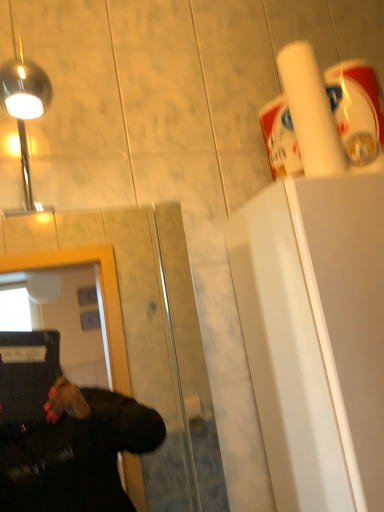
Question: Would you say transparent glass door at center is a long distance from white matte paper towel at upper right?

Choices:
 (A) no
 (B) yes

Answer: (A)

Question: Can you confirm if transparent glass door at center is wider than white matte paper towel at upper right?

Choices:
 (A) yes
 (B) no

Answer: (A)

Question: Is transparent glass door at center positioned in front of white matte paper towel at upper right?

Choices:
 (A) yes
 (B) no

Answer: (A)

Question: Is white matte paper towel at upper right a part of transparent glass door at center?

Choices:
 (A) no
 (B) yes

Answer: (A)

Question: From the image's perspective, does transparent glass door at center appear lower than white matte paper towel at upper right?

Choices:
 (A) no
 (B) yes

Answer: (B)

Question: Is transparent glass door at center oriented towards white matte paper towel at upper right?

Choices:
 (A) yes
 (B) no

Answer: (B)

Question: Considering the relative sizes of polished chrome light at upper left and transparent glass door at center in the image provided, is polished chrome light at upper left taller than transparent glass door at center?

Choices:
 (A) yes
 (B) no

Answer: (B)

Question: Does polished chrome light at upper left lie in front of transparent glass door at center?

Choices:
 (A) no
 (B) yes

Answer: (A)

Question: Is polished chrome light at upper left completely or partially outside of transparent glass door at center?

Choices:
 (A) yes
 (B) no

Answer: (A)

Question: Is polished chrome light at upper left aimed at transparent glass door at center?

Choices:
 (A) no
 (B) yes

Answer: (A)

Question: Would you say polished chrome light at upper left contains transparent glass door at center?

Choices:
 (A) no
 (B) yes

Answer: (A)

Question: Considering the relative positions of polished chrome light at upper left and transparent glass door at center in the image provided, is polished chrome light at upper left to the right of transparent glass door at center from the viewer's perspective?

Choices:
 (A) yes
 (B) no

Answer: (B)

Question: From a real-world perspective, is transparent glass door at center located beneath polished chrome light at upper left?

Choices:
 (A) yes
 (B) no

Answer: (A)